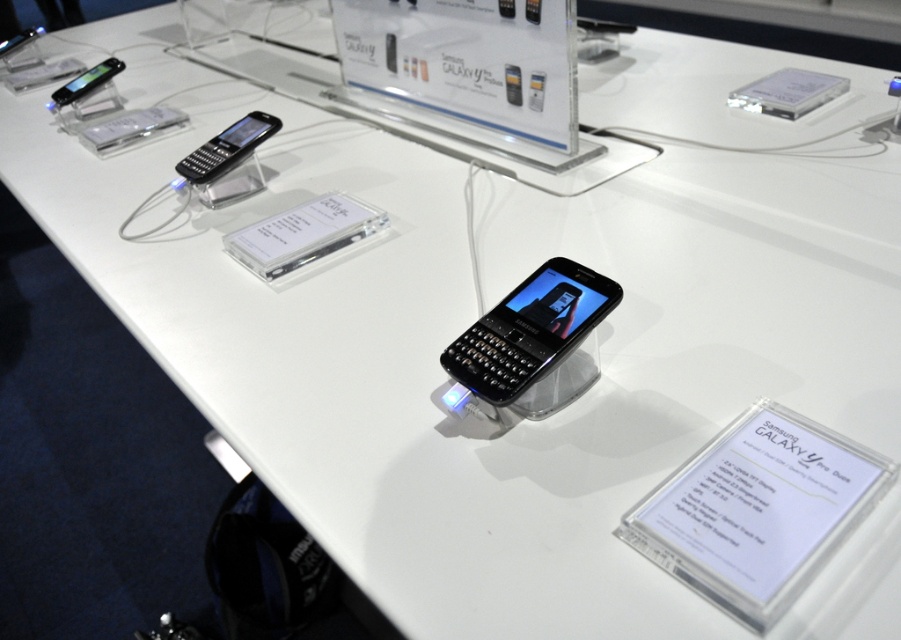
Imagine you are setting up a promotional display for the Samsung Galaxy Y Pro. You need to place a new phone exactly where the black matte keyboard phone at center is currently located. What are the coordinates for placing the new phone?

The coordinates for placing the new phone should be at point (535,340), which is the 2D location of the black matte keyboard phone at center.

You are a customer looking to buy a Samsung Galaxy Y Pro phone. You see two phones labeled as black glossy phone at upper left and matte black phone at upper left. Which one is smaller in size?

The black glossy phone at upper left is smaller than the matte black phone at upper left.

You are standing in front of the Samsung Galaxy Y Pro display and want to touch the point that is closer to you. Which point should you choose between point (508, 406) and point (88, 72)?

Point (508, 406) is in front of point (88, 72), so you should choose point (508, 406) as it is closer to you.